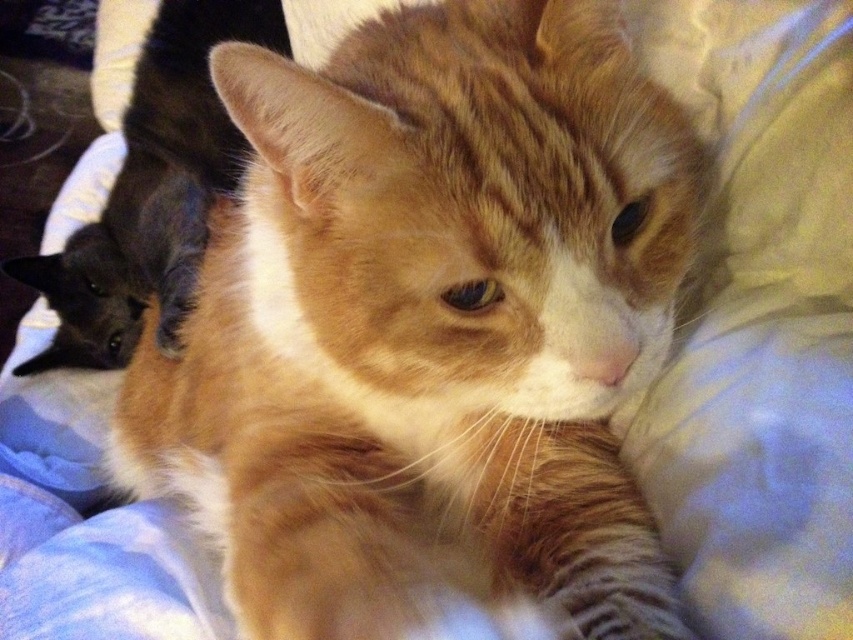
Can you confirm if orange tabby cat at center is wider than black glossy cat at left?

Correct, the width of orange tabby cat at center exceeds that of black glossy cat at left.

Locate an element on the screen. The image size is (853, 640). orange tabby cat at center is located at coordinates point(428,324).

This screenshot has height=640, width=853. Find the location of `orange tabby cat at center`. orange tabby cat at center is located at coordinates (428, 324).